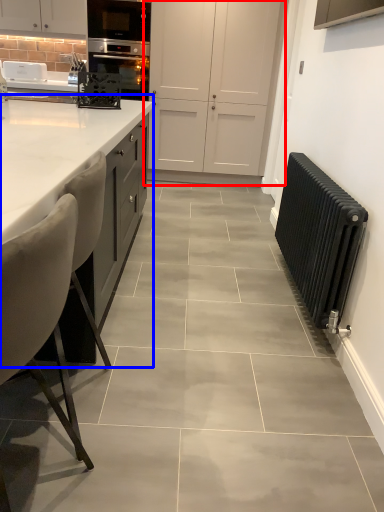
Question: Among these objects, which one is farthest to the camera, cabinetry (highlighted by a red box) or countertop (highlighted by a blue box)?

Choices:
 (A) cabinetry
 (B) countertop

Answer: (A)